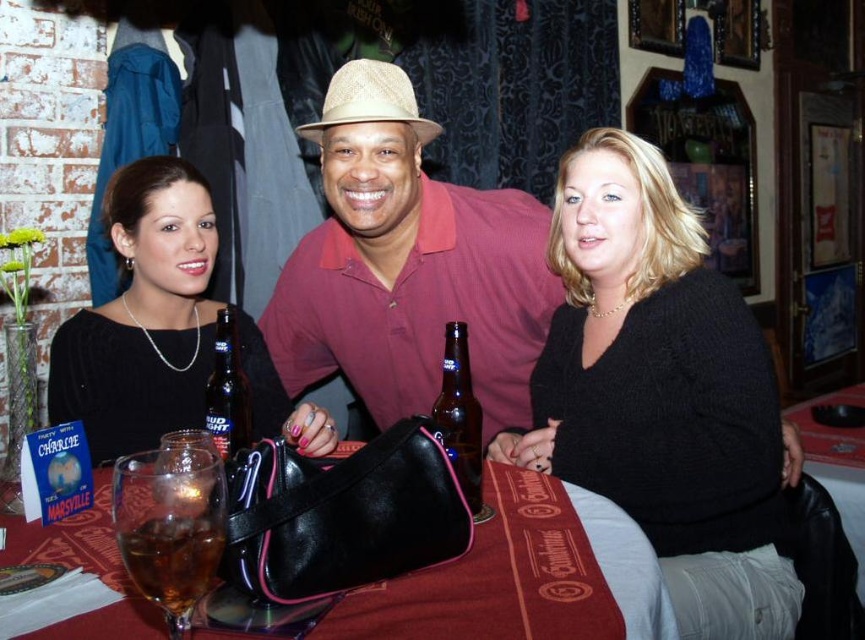
Question: Which point is farther to the camera?

Choices:
 (A) matte straw hat at center
 (B) straw hat at center

Answer: (A)

Question: Does brown liquid glass at lower left have a smaller size compared to straw hat at center?

Choices:
 (A) yes
 (B) no

Answer: (A)

Question: Does smooth leather purse at center have a smaller size compared to translucent glass bottle at center?

Choices:
 (A) yes
 (B) no

Answer: (B)

Question: Is matte straw hat at center closer to camera compared to brown liquid glass at lower left?

Choices:
 (A) yes
 (B) no

Answer: (B)

Question: Which of the following is the closest to the observer?

Choices:
 (A) translucent glass bottle at center
 (B) black knit sweater at center
 (C) brown liquid glass at lower left
 (D) brown glass bottle at center

Answer: (C)

Question: Which object appears closest to the camera in this image?

Choices:
 (A) matte straw hat at center
 (B) translucent glass bottle at center

Answer: (B)